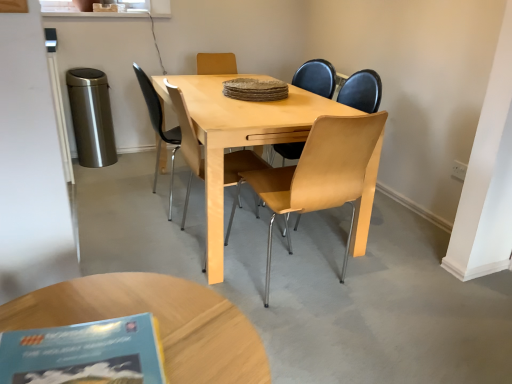
Locate an element on the screen. free space above light brown wooden coffee table at lower center (from a real-world perspective) is located at coordinates (134, 315).